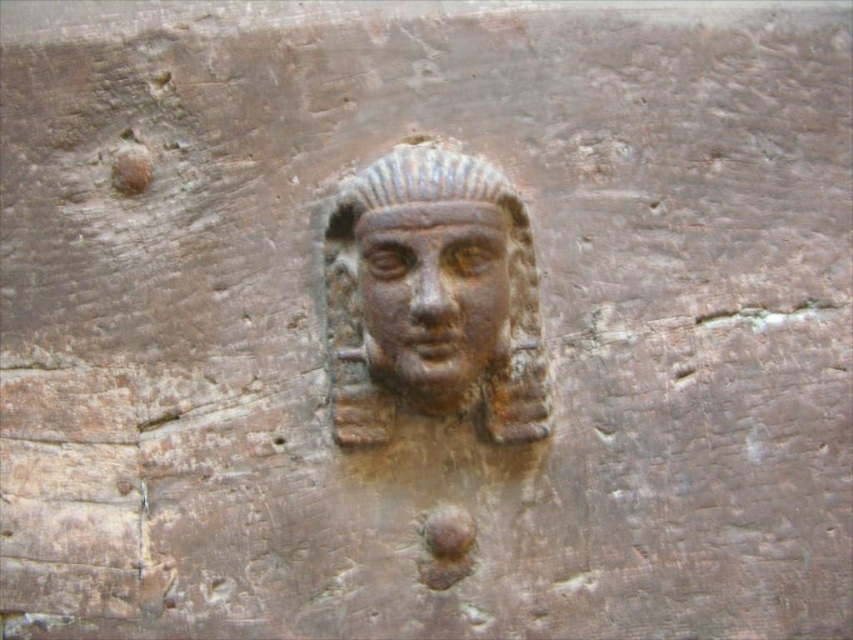
You are an archaeologist examining a carved wooden panel. You notice two features, the rusty stone head at center and the rusty bronze face at center. Which one is closer to the edge of the wooden panel?

Both the rusty stone head at center and the rusty bronze face at center are at the center of the panel, so neither is closer to the edge. They are 1.33 centimeters apart from each other but equally distant from the edges.

You are holding a camera and want to take a photo of the rusty stone head at center. If your camera requires a minimum distance of 1 meter to focus properly, will you be able to take a clear photo from your current position?

The rusty stone head at center and camera are 1.09 meters apart. Since the required minimum distance is 1 meter, you can take a clear photo as the distance is sufficient.

Based on the scene description, which object at the center is wider, the rusty stone head at center or the rusty bronze face at center?

The rusty stone head at center is wider than the rusty bronze face at center according to the description.